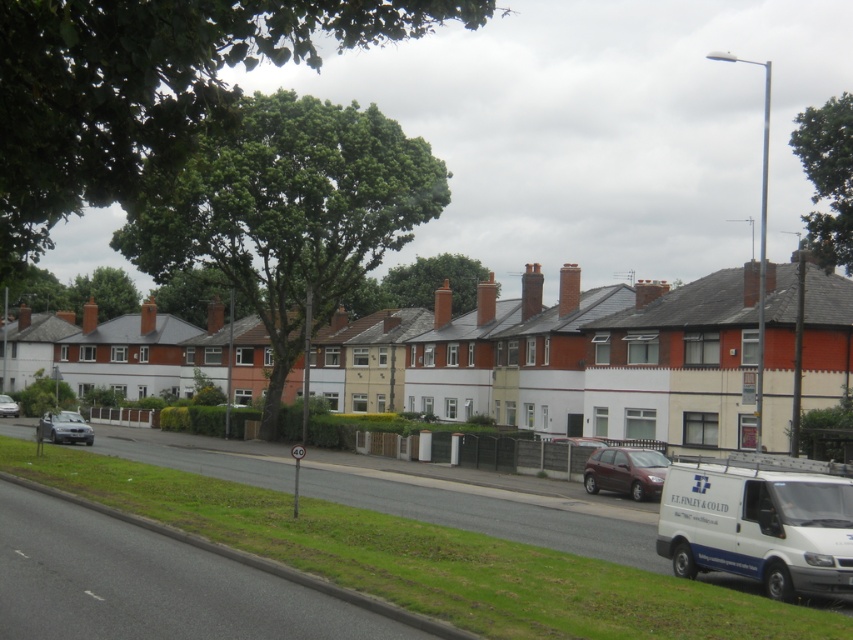
Is point (776, 525) more distant than point (62, 424)?

No.

Which of these two, white matte van at lower right or shiny silver car at lower left, stands taller?

shiny silver car at lower left is taller.

Does point (672, 468) come behind point (54, 433)?

No, (672, 468) is in front of (54, 433).

Image resolution: width=853 pixels, height=640 pixels. Identify the location of white matte van at lower right. (758, 525).

Is green grass at lower left wider than maroon matte hatchback at center?

Correct, the width of green grass at lower left exceeds that of maroon matte hatchback at center.

Between green grass at lower left and maroon matte hatchback at center, which one is positioned lower?

Positioned lower is green grass at lower left.

Is point (486, 518) positioned in front of point (659, 476)?

Yes, it is in front of point (659, 476).

Find the location of a particular element. green grass at lower left is located at coordinates (430, 545).

Does shiny silver car at lower left appear over silver metallic car at left?

Correct, shiny silver car at lower left is located above silver metallic car at left.

Which is below, shiny silver car at lower left or silver metallic car at left?

Positioned lower is silver metallic car at left.

This screenshot has height=640, width=853. What do you see at coordinates (64, 428) in the screenshot?
I see `shiny silver car at lower left` at bounding box center [64, 428].

Locate an element on the screen. This screenshot has width=853, height=640. shiny silver car at lower left is located at coordinates (64, 428).